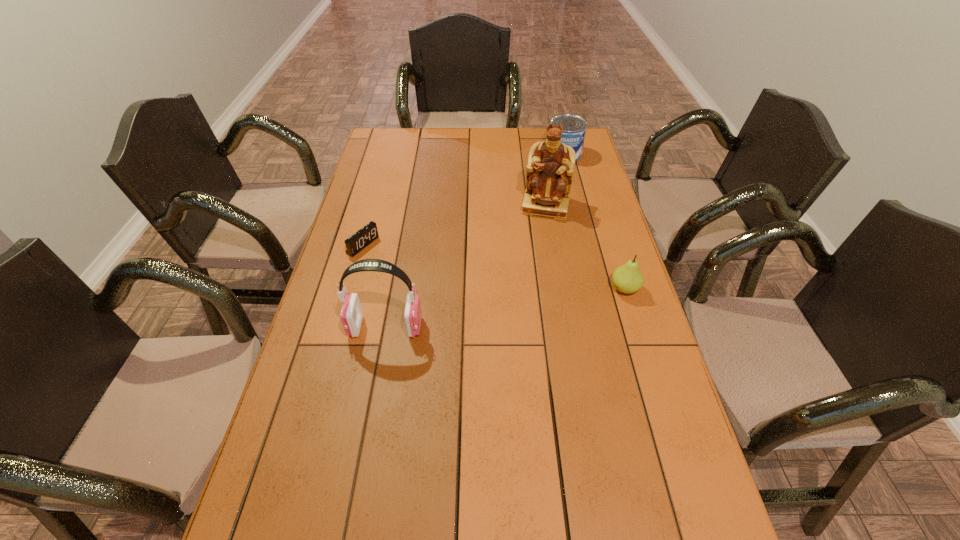
Find the location of a particular element. This screenshot has height=540, width=960. vacant space located on the outer surface of the earphone is located at coordinates (324, 327).

Locate an element on the screen. blank space located on the front of the second nearest object is located at coordinates (665, 421).

Image resolution: width=960 pixels, height=540 pixels. I want to click on vacant space positioned on the front-facing side of the shortest object, so click(x=471, y=305).

Locate an element on the screen. blank area located on the front-facing side of the shortest object is located at coordinates (460, 299).

Find the location of a particular element. free space located on the front-facing side of the shortest object is located at coordinates (468, 303).

Image resolution: width=960 pixels, height=540 pixels. I want to click on free space located 0.180m on the front-facing side of the second farthest object, so click(x=534, y=255).

Locate an element on the screen. This screenshot has height=540, width=960. vacant position located on the front-facing side of the second farthest object is located at coordinates (530, 273).

Where is `vacant area situated on the front-facing side of the second farthest object`? The image size is (960, 540). vacant area situated on the front-facing side of the second farthest object is located at coordinates (532, 266).

Locate an element on the screen. Image resolution: width=960 pixels, height=540 pixels. blank space located on the front label of the can is located at coordinates coord(552,180).

This screenshot has width=960, height=540. Find the location of `free space located 0.230m on the front label of the can`. free space located 0.230m on the front label of the can is located at coordinates (544, 195).